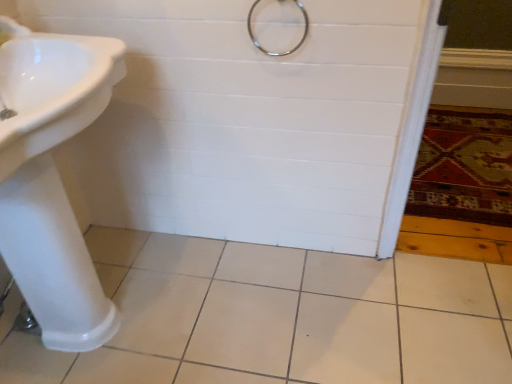
Question: Does white ceramic tile at center touch metallic ring at upper center?

Choices:
 (A) yes
 (B) no

Answer: (B)

Question: Can you confirm if white ceramic tile at center is smaller than metallic ring at upper center?

Choices:
 (A) yes
 (B) no

Answer: (B)

Question: Is white ceramic tile at center outside metallic ring at upper center?

Choices:
 (A) yes
 (B) no

Answer: (A)

Question: Is white ceramic tile at center bigger than metallic ring at upper center?

Choices:
 (A) yes
 (B) no

Answer: (A)

Question: From the image's perspective, is white ceramic tile at center located above metallic ring at upper center?

Choices:
 (A) no
 (B) yes

Answer: (A)

Question: Does white ceramic tile at center have a greater height compared to metallic ring at upper center?

Choices:
 (A) yes
 (B) no

Answer: (B)

Question: Is white glossy sink at left positioned far away from white ceramic tile at center?

Choices:
 (A) yes
 (B) no

Answer: (B)

Question: Does white glossy sink at left appear on the left side of white ceramic tile at center?

Choices:
 (A) no
 (B) yes

Answer: (B)

Question: From the image's perspective, would you say white glossy sink at left is shown under white ceramic tile at center?

Choices:
 (A) yes
 (B) no

Answer: (B)

Question: Is white glossy sink at left next to white ceramic tile at center and touching it?

Choices:
 (A) no
 (B) yes

Answer: (A)

Question: Can you confirm if white glossy sink at left is thinner than white ceramic tile at center?

Choices:
 (A) yes
 (B) no

Answer: (A)

Question: Is the position of white glossy sink at left less distant than that of white ceramic tile at center?

Choices:
 (A) yes
 (B) no

Answer: (A)

Question: Considering the relative sizes of white ceramic tile at center and white glossy sink at left in the image provided, is white ceramic tile at center smaller than white glossy sink at left?

Choices:
 (A) yes
 (B) no

Answer: (A)